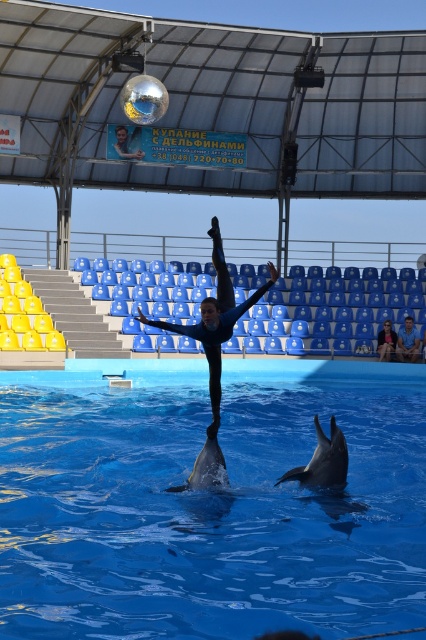
You are designing a new aquatic show and need to ensure that the blue matte gymnast at center and the smooth gray dolphin at lower center fit within a 10x10 meter stage. Given their sizes, will they both comfortably fit on the stage?

The blue matte gymnast at center occupies less space than the smooth gray dolphin at lower center. Since both objects are within the 10x10 meter stage, they will comfortably fit together without any issues.

You are a photographer trying to capture a closeup of the blue matte gymnast at center and the smooth gray dolphin at lower center. Which one will appear narrower in your photo?

The blue matte gymnast at center is thinner than the smooth gray dolphin at lower center, so it will appear narrower in the photo.

You are a photographer standing at the edge of the pool. You want to take a photo of the blue matte gymnast at center and the light brown leather jacket at lower right. Which object should you focus on first if you want to capture both in the same frame without moving the camera?

The blue matte gymnast at center has a lesser height compared to light brown leather jacket at lower right, so you should focus on the light brown leather jacket at lower right first because it is taller and will be easier to frame properly.